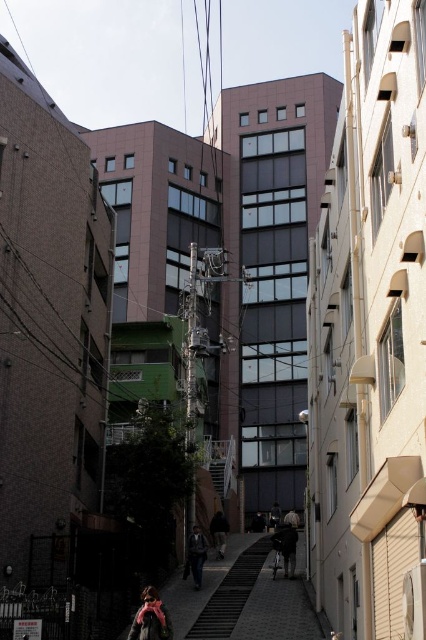
Question: Is concrete stairs at center thinner than dark gray leather jacket at center?

Choices:
 (A) no
 (B) yes

Answer: (A)

Question: Which object is farther from the camera taking this photo?

Choices:
 (A) dark gray fabric jacket at center
 (B) concrete stairs at center
 (C) matte pink scarf at lower center
 (D) dark gray leather jacket at center

Answer: (A)

Question: Which of the following is the farthest from the observer?

Choices:
 (A) dark gray leather jacket at center
 (B) matte pink scarf at lower center

Answer: (A)

Question: Does dark gray leather jacket at center appear on the right side of dark gray fabric jacket at center?

Choices:
 (A) yes
 (B) no

Answer: (B)

Question: Which object is farther from the camera taking this photo?

Choices:
 (A) concrete stairs at center
 (B) matte pink scarf at lower center

Answer: (A)

Question: Does matte pink scarf at lower center appear over dark gray fabric jacket at center?

Choices:
 (A) yes
 (B) no

Answer: (A)